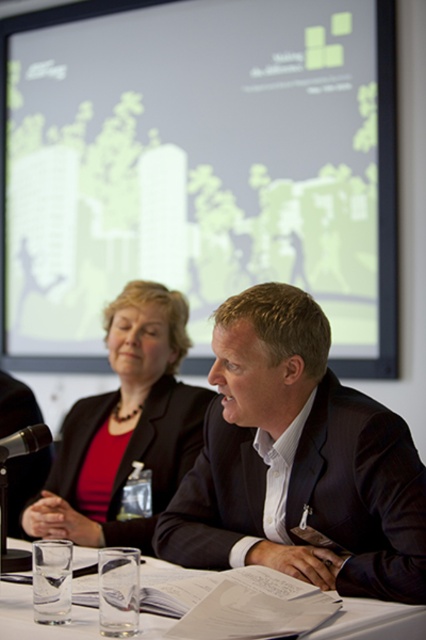
Question: Which of these objects is positioned farthest from the black plastic microphone at left?

Choices:
 (A) matte black blazer at center
 (B) clear glass at center
 (C) dark suit at center
 (D) matte white projection screen at upper center

Answer: (D)

Question: Is matte black blazer at center above black matte business suit at left?

Choices:
 (A) yes
 (B) no

Answer: (A)

Question: Can you confirm if clear glass at center is wider than black matte business suit at left?

Choices:
 (A) no
 (B) yes

Answer: (B)

Question: Is clear glass at center positioned behind black plastic microphone at left?

Choices:
 (A) no
 (B) yes

Answer: (A)

Question: Which of the following is the farthest from the observer?

Choices:
 (A) (417, 624)
 (B) (160, 358)

Answer: (B)

Question: Which object appears farthest from the camera in this image?

Choices:
 (A) black matte business suit at left
 (B) matte white projection screen at upper center
 (C) black plastic microphone at left

Answer: (B)